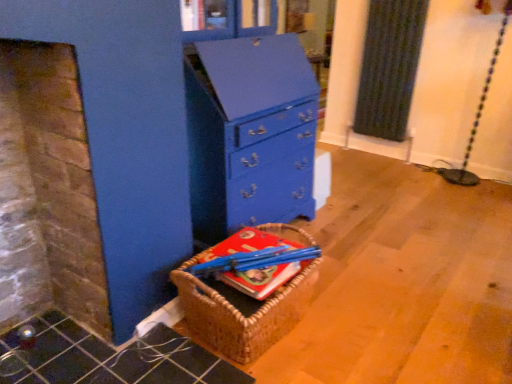
Question: Is blue painted wood chest of drawers at center shorter than woven brown basket at lower left?

Choices:
 (A) yes
 (B) no

Answer: (B)

Question: Considering the relative sizes of blue painted wood chest of drawers at center and woven brown basket at lower left in the image provided, is blue painted wood chest of drawers at center smaller than woven brown basket at lower left?

Choices:
 (A) no
 (B) yes

Answer: (A)

Question: Is blue painted wood chest of drawers at center at the right side of woven brown basket at lower left?

Choices:
 (A) yes
 (B) no

Answer: (B)

Question: Does blue painted wood chest of drawers at center turn towards woven brown basket at lower left?

Choices:
 (A) yes
 (B) no

Answer: (B)

Question: From a real-world perspective, does blue painted wood chest of drawers at center sit lower than woven brown basket at lower left?

Choices:
 (A) no
 (B) yes

Answer: (A)

Question: From the image's perspective, is blue painted wood chest of drawers at center on woven brown basket at lower left?

Choices:
 (A) yes
 (B) no

Answer: (A)

Question: From the image's perspective, does blue painted wood chest of drawers at center appear lower than hardcover book at center?

Choices:
 (A) yes
 (B) no

Answer: (B)

Question: Is blue painted wood chest of drawers at center turned away from hardcover book at center?

Choices:
 (A) yes
 (B) no

Answer: (B)

Question: From the image's perspective, is blue painted wood chest of drawers at center on hardcover book at center?

Choices:
 (A) no
 (B) yes

Answer: (B)

Question: Can you confirm if blue painted wood chest of drawers at center is shorter than hardcover book at center?

Choices:
 (A) yes
 (B) no

Answer: (B)

Question: Does blue painted wood chest of drawers at center have a lesser width compared to hardcover book at center?

Choices:
 (A) no
 (B) yes

Answer: (A)

Question: Is hardcover book at center completely or partially inside blue painted wood chest of drawers at center?

Choices:
 (A) yes
 (B) no

Answer: (B)

Question: Is hardcover book at center smaller than woven brown basket at lower left?

Choices:
 (A) no
 (B) yes

Answer: (B)